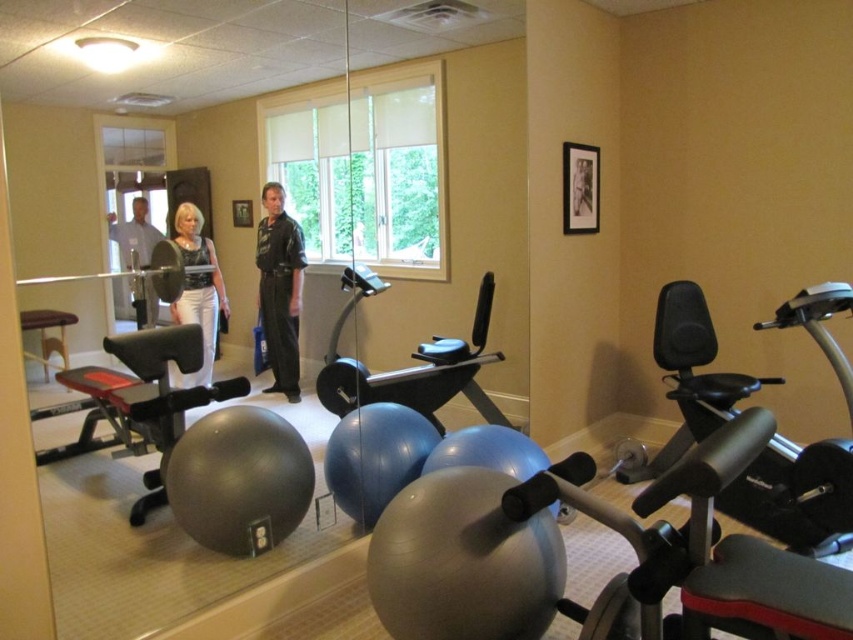
Question: Which point is closer to the camera?

Choices:
 (A) black plastic exercise bike at center
 (B) black leather jacket at center
 (C) matte black tank top at center
 (D) light beige shirt at center

Answer: (D)

Question: Can you confirm if matte gray exercise ball at center is positioned to the right of matte black tank top at center?

Choices:
 (A) no
 (B) yes

Answer: (A)

Question: Which point is closer to the camera?

Choices:
 (A) black plastic exercise bike at center
 (B) matte black exercise ball at center
 (C) black leather jacket at center

Answer: (C)

Question: Is black plastic exercise bike at center behind matte black exercise ball at center?

Choices:
 (A) no
 (B) yes

Answer: (B)

Question: Which of the following is the farthest from the observer?

Choices:
 (A) (206, 333)
 (B) (142, 262)
 (C) (688, 291)
 (D) (142, 396)

Answer: (C)

Question: Where is matte gray exercise ball at center located in relation to black leather jacket at center in the image?

Choices:
 (A) below
 (B) above

Answer: (A)